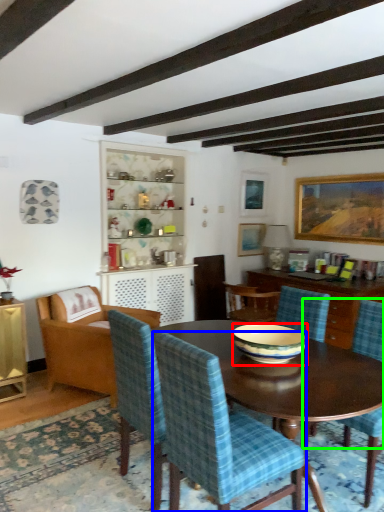
Question: Based on their relative distances, which object is farther from bowl (highlighted by a red box)? Choose from chair (highlighted by a blue box) and chair (highlighted by a green box).

Choices:
 (A) chair
 (B) chair

Answer: (B)